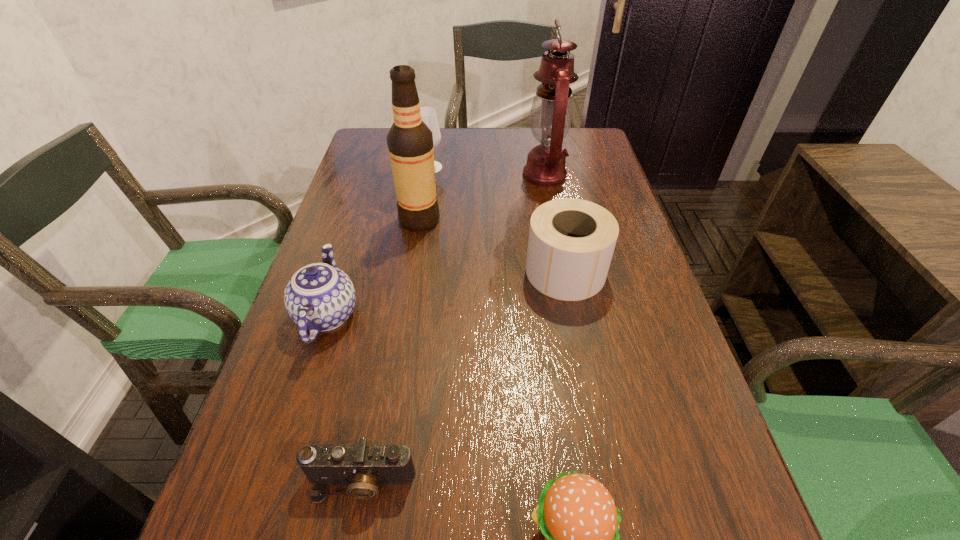
Find the location of `oil lamp`. oil lamp is located at coordinates coord(551,114).

This screenshot has height=540, width=960. I want to click on alcohol, so click(410, 142).

Identify the location of glass. The height and width of the screenshot is (540, 960). tap(428, 115).

Image resolution: width=960 pixels, height=540 pixels. I want to click on toilet tissue, so click(571, 242).

I want to click on chinaware, so click(x=319, y=297).

Locate an element on the screen. The image size is (960, 540). camera is located at coordinates (362, 466).

Where is `vacant space located 0.320m on the front of the oil lamp`? Image resolution: width=960 pixels, height=540 pixels. vacant space located 0.320m on the front of the oil lamp is located at coordinates (564, 274).

Where is `vacant space located on the label of the alcohol`? This screenshot has height=540, width=960. vacant space located on the label of the alcohol is located at coordinates (545, 220).

Where is `free space located 0.310m on the front of the fifth shortest object`? This screenshot has width=960, height=540. free space located 0.310m on the front of the fifth shortest object is located at coordinates (418, 244).

Find the location of a particular element. The image size is (960, 540). vacant space located on the front of the toilet tissue is located at coordinates (602, 455).